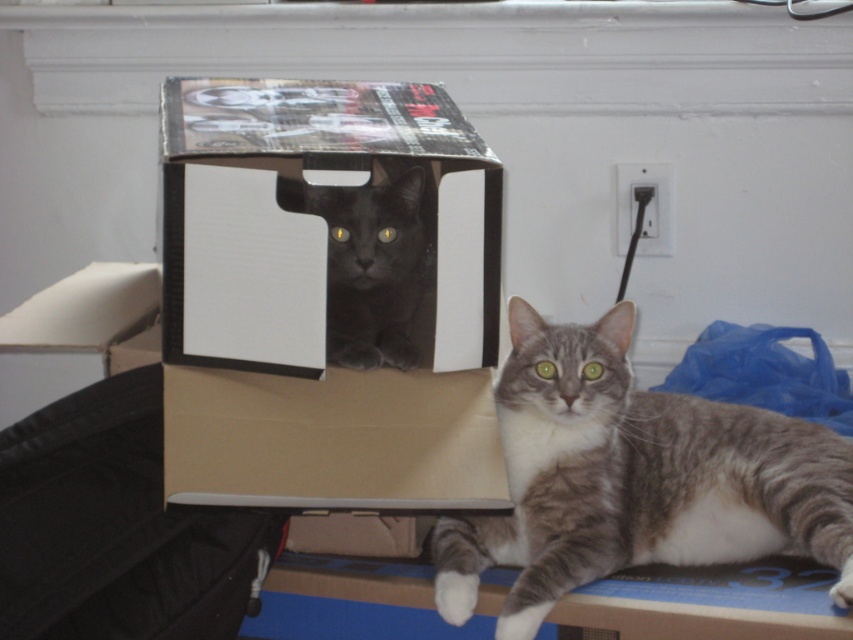
Is gray tabby cat at center to the right of matte cardboard box at upper center from the viewer's perspective?

Yes, gray tabby cat at center is to the right of matte cardboard box at upper center.

Measure the distance from gray tabby cat at center to matte cardboard box at upper center.

14.73 inches

Locate an element on the screen. This screenshot has width=853, height=640. gray tabby cat at center is located at coordinates (634, 477).

Between cardboard box at center and gray tabby cat at center, which one appears on the right side from the viewer's perspective?

gray tabby cat at center is more to the right.

Which is behind, point (177, 460) or point (715, 486)?

Point (715, 486)

The width and height of the screenshot is (853, 640). What do you see at coordinates (325, 300) in the screenshot? I see `cardboard box at center` at bounding box center [325, 300].

Where is `cardboard box at center`? This screenshot has width=853, height=640. cardboard box at center is located at coordinates (325, 300).

Does gray tabby cat at center have a greater height compared to shiny black cat at center?

Yes.

Does point (515, 390) come closer to viewer compared to point (283, 205)?

That is True.

At what (x,y) coordinates should I click in order to perform the action: click on gray tabby cat at center. Please return your answer as a coordinate pair (x, y). This screenshot has height=640, width=853. Looking at the image, I should click on (634, 477).